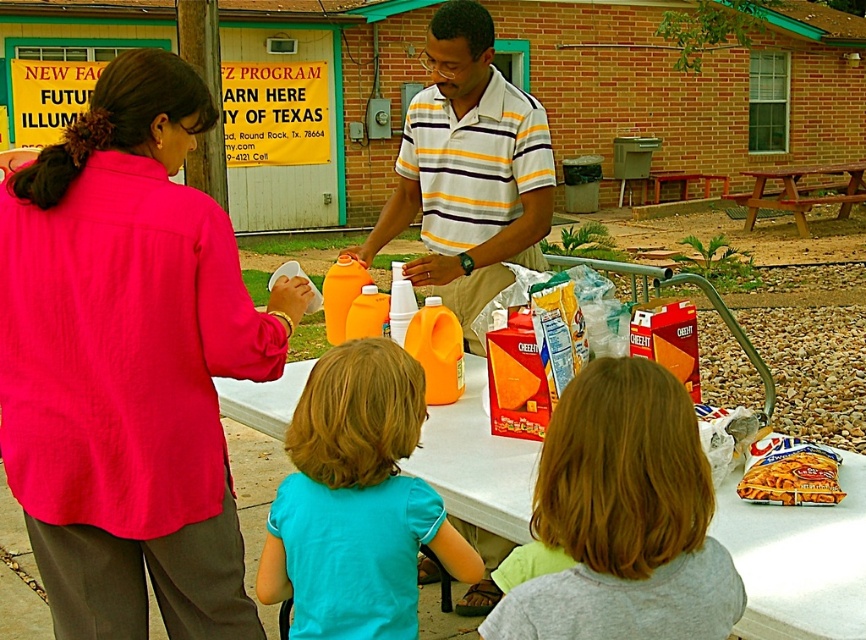
Question: Can you confirm if striped cotton shirt at center is wider than striped cotton polo shirt at center?

Choices:
 (A) yes
 (B) no

Answer: (A)

Question: Which of the following is the farthest from the observer?

Choices:
 (A) smooth brown hair at lower center
 (B) teal cotton shirt at center
 (C) matte pink blouse at center

Answer: (C)

Question: Is matte pink blouse at center wider than striped cotton shirt at center?

Choices:
 (A) yes
 (B) no

Answer: (B)

Question: Which object is the farthest from the wooden picnic table at center?

Choices:
 (A) teal cotton shirt at center
 (B) striped cotton shirt at center
 (C) striped cotton polo shirt at center
 (D) smooth brown hair at lower center

Answer: (D)

Question: Can you confirm if matte pink blouse at center is thinner than striped cotton shirt at center?

Choices:
 (A) no
 (B) yes

Answer: (B)

Question: Which object is farther from the camera taking this photo?

Choices:
 (A) matte orange juice carton at center
 (B) smooth brown hair at lower center
 (C) white plastic table at lower center
 (D) teal cotton shirt at center

Answer: (A)